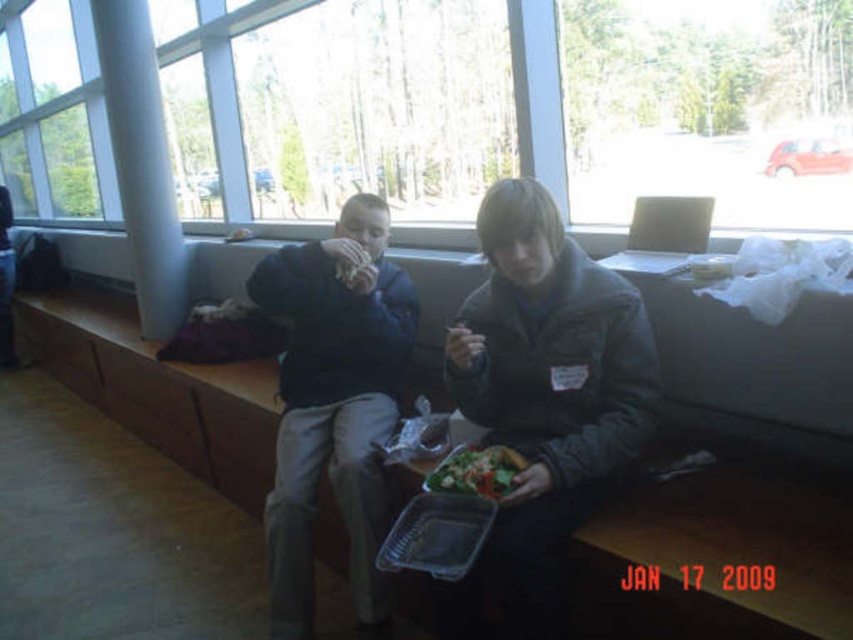
Question: In this image, where is dark gray jacket at center located relative to dark blue jacket at center?

Choices:
 (A) right
 (B) left

Answer: (A)

Question: Based on their relative distances, which object is farther from the dark gray jacket at center?

Choices:
 (A) green leafy salad at center
 (B) transparent glass window at upper center
 (C) white smooth pillar at center

Answer: (B)

Question: Is the position of transparent glass window at upper center less distant than that of dark gray jacket at center?

Choices:
 (A) yes
 (B) no

Answer: (B)

Question: Observing the image, what is the correct spatial positioning of transparent glass window at upper center in reference to matte brown sandwich at center?

Choices:
 (A) below
 (B) above

Answer: (B)

Question: Estimate the real-world distances between objects in this image. Which object is closer to the green leafy salad at center?

Choices:
 (A) dark blue jacket at center
 (B) transparent glass window at upper center

Answer: (A)

Question: Among these points, which one is nearest to the camera?

Choices:
 (A) (496, 499)
 (B) (396, 276)
 (C) (167, 296)
 (D) (686, 161)

Answer: (A)